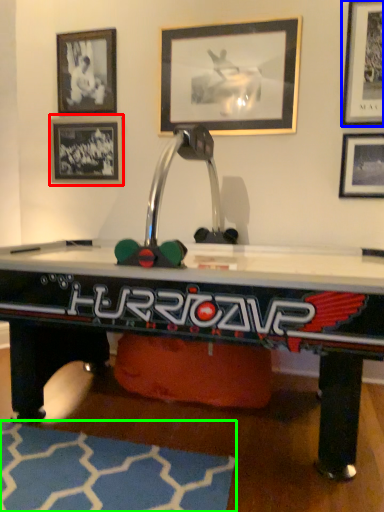
Question: Estimate the real-world distances between objects in this image. Which object is farther from picture frame (highlighted by a red box), picture frame (highlighted by a blue box) or mat (highlighted by a green box)?

Choices:
 (A) picture frame
 (B) mat

Answer: (B)